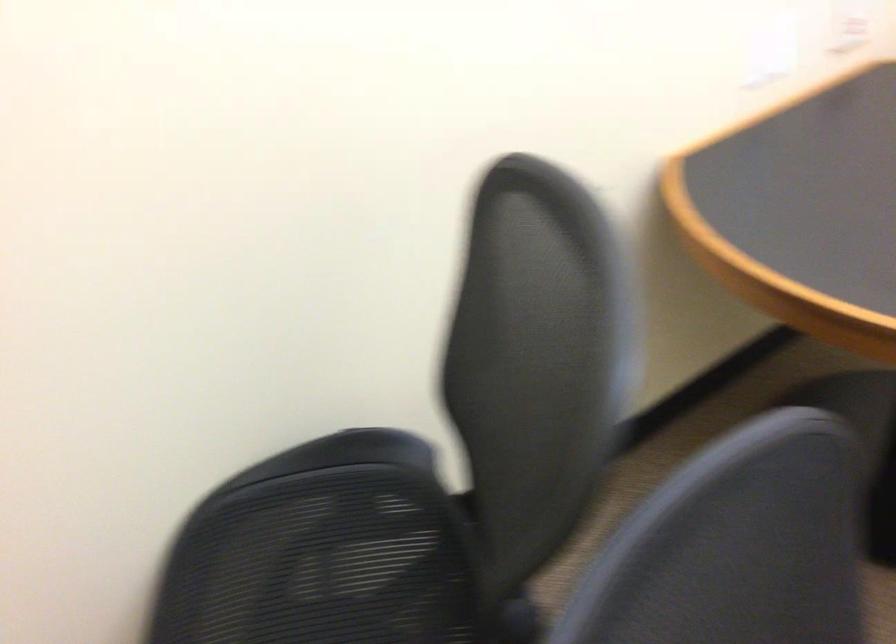
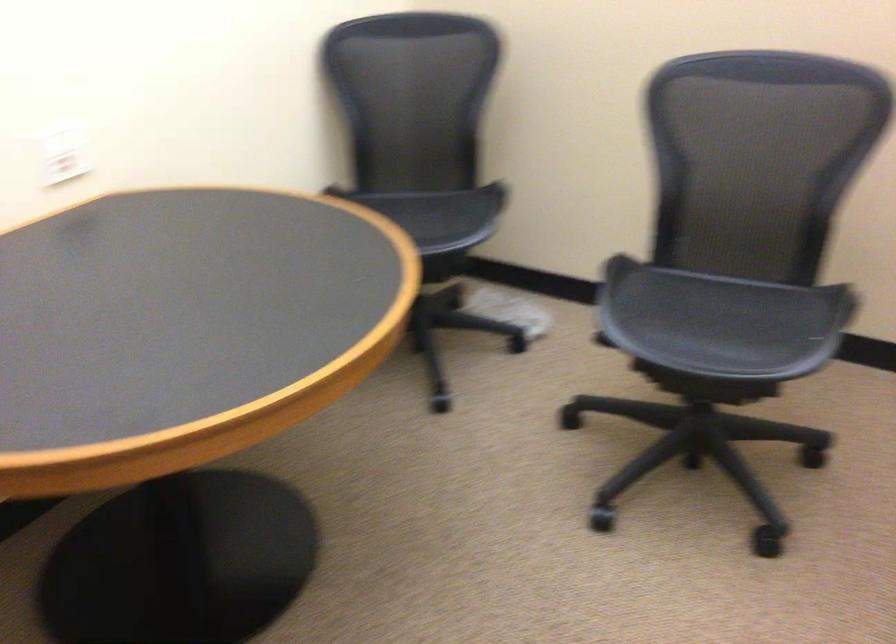
Question: What movement of the cameraman would produce the second image?

Choices:
 (A) Left
 (B) Right
 (C) Forward
 (D) Backward

Answer: (B)